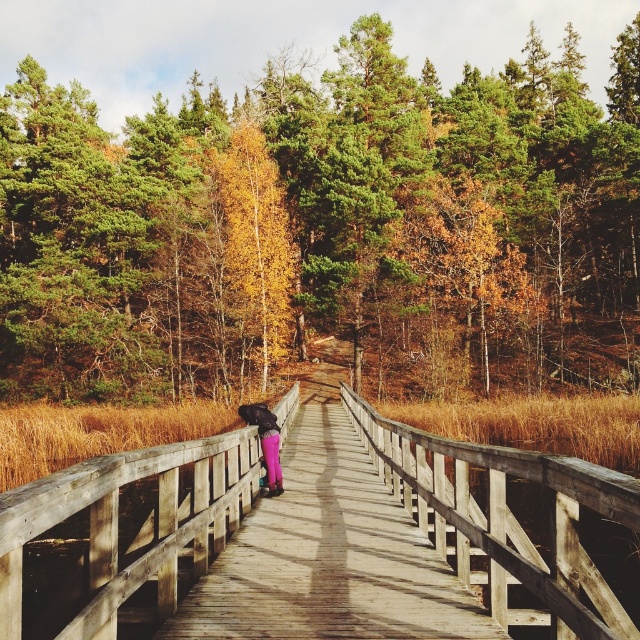
Question: Does wooden bridge at center lie in front of purple matte pants at center?

Choices:
 (A) yes
 (B) no

Answer: (A)

Question: Which object is positioned farthest from the green textured trees at upper center?

Choices:
 (A) purple matte pants at center
 (B) wooden bridge at center

Answer: (A)

Question: Which point is closer to the camera?

Choices:
 (A) green textured trees at upper center
 (B) wooden bridge at center

Answer: (B)

Question: Can you confirm if green textured trees at upper center is positioned to the right of purple matte pants at center?

Choices:
 (A) yes
 (B) no

Answer: (A)

Question: Is wooden bridge at center further to the viewer compared to purple matte pants at center?

Choices:
 (A) yes
 (B) no

Answer: (B)

Question: Based on their relative distances, which object is farther from the wooden bridge at center?

Choices:
 (A) green textured trees at upper center
 (B) purple matte pants at center

Answer: (A)